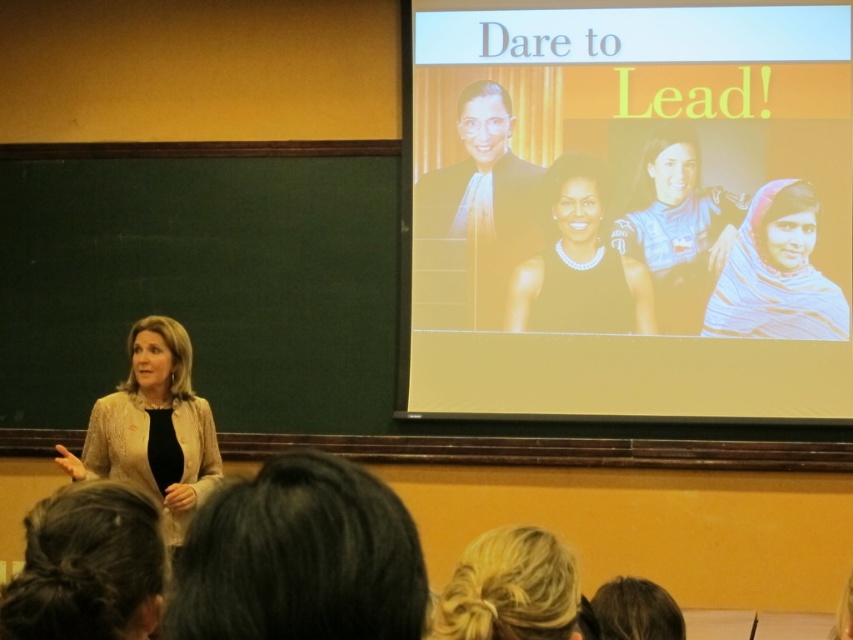
Is matte yellow projection screen at upper center further to the viewer compared to dark brown hair at lower center?

Yes, it is behind dark brown hair at lower center.

Between matte yellow projection screen at upper center and dark brown hair at lower center, which one has more height?

matte yellow projection screen at upper center

Is point (634, 61) in front of point (281, 568)?

No.

I want to click on matte yellow projection screen at upper center, so coord(631,209).

Is dark brown hair at lower center closer to camera compared to white textured scarf at right?

Yes.

Between dark brown hair at lower center and white textured scarf at right, which one appears on the right side from the viewer's perspective?

Positioned to the right is white textured scarf at right.

Does point (287, 548) lie behind point (776, 220)?

That is False.

Locate an element on the screen. dark brown hair at lower center is located at coordinates (299, 557).

Which is more to the left, matte yellow projection screen at upper center or black satin dress at center?

black satin dress at center is more to the left.

Can you confirm if matte yellow projection screen at upper center is smaller than black satin dress at center?

No.

Is point (722, 321) less distant than point (515, 314)?

Yes, point (722, 321) is in front of point (515, 314).

Where is `matte yellow projection screen at upper center`? The height and width of the screenshot is (640, 853). matte yellow projection screen at upper center is located at coordinates pyautogui.click(x=631, y=209).